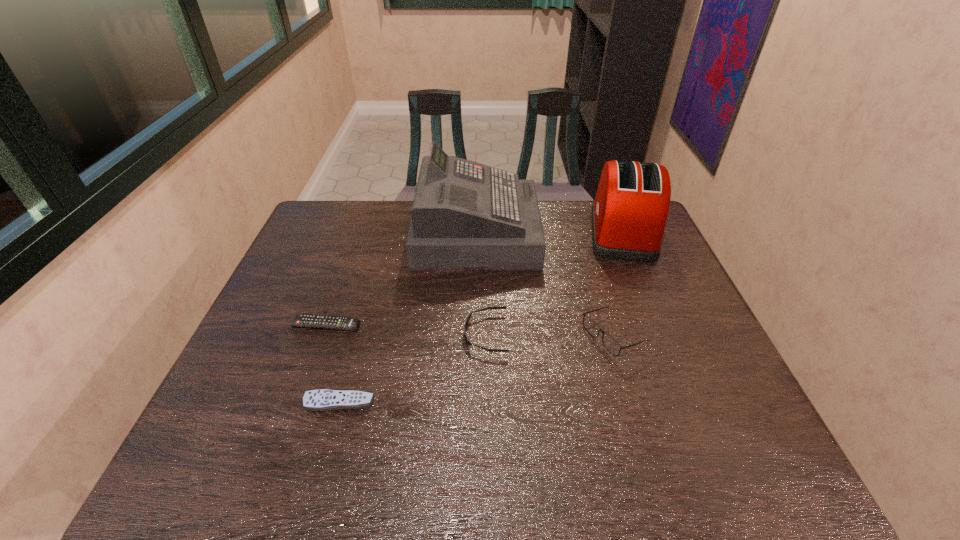
Where is `cash register`? The height and width of the screenshot is (540, 960). cash register is located at coordinates (465, 215).

This screenshot has height=540, width=960. In order to click on toaster in this screenshot , I will do `click(629, 213)`.

At what (x,y) coordinates should I click in order to perform the action: click on spectacles. Please return your answer as a coordinate pair (x, y). Looking at the image, I should click on (609, 343).

Find the location of a particular element. the third shortest object is located at coordinates (467, 340).

Identify the location of the farther remote control. The width and height of the screenshot is (960, 540). (301, 320).

You are a GUI agent. You are given a task and a screenshot of the screen. Output one action in this format:
    pyautogui.click(x=<x>, y=<y>)
    Task: Click on the nearer remote control
    Image resolution: width=960 pixels, height=540 pixels.
    Given the screenshot: What is the action you would take?
    pyautogui.click(x=321, y=399)

Find the location of a particular element. vacant space located on the front-facing side of the cash register is located at coordinates [x=583, y=233].

In order to click on free location located 0.340m on the left of the toaster in this screenshot , I will do `click(484, 232)`.

Locate an element on the screen. The width and height of the screenshot is (960, 540). vacant area situated 0.130m with the lenses facing outward on the fourth shortest object is located at coordinates [533, 336].

The width and height of the screenshot is (960, 540). Identify the location of free point located with the lenses facing outward on the fourth shortest object. (490, 336).